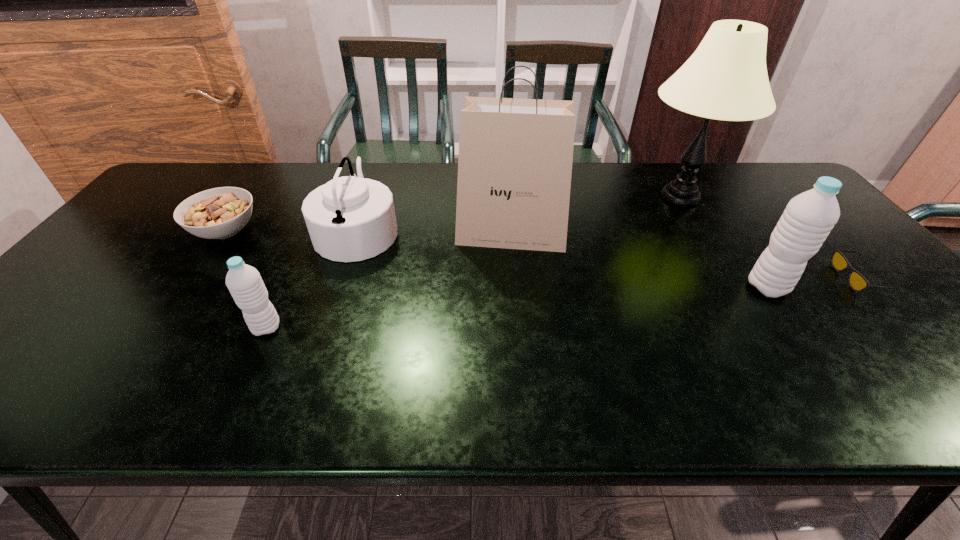
Find the location of `the nearer water bottle`. the nearer water bottle is located at coordinates (244, 282).

The width and height of the screenshot is (960, 540). I want to click on the nearest object, so click(244, 282).

The image size is (960, 540). I want to click on the farther water bottle, so click(x=809, y=217).

What are the coordinates of `the right water bottle` in the screenshot? It's located at (809, 217).

This screenshot has width=960, height=540. In order to click on lamp in this screenshot , I will do `click(726, 78)`.

You are a GUI agent. You are given a task and a screenshot of the screen. Output one action in this format:
    pyautogui.click(x=<x>, y=<y>)
    Task: Click on the leftmost object
    The width and height of the screenshot is (960, 540).
    Given the screenshot: What is the action you would take?
    pyautogui.click(x=218, y=213)

Locate an element on the screen. stew is located at coordinates (218, 213).

This screenshot has width=960, height=540. Identify the location of shopping bag. (515, 159).

Locate an element on the screen. kettle is located at coordinates (350, 218).

Locate an element on the screen. sunglasses is located at coordinates coord(857,282).